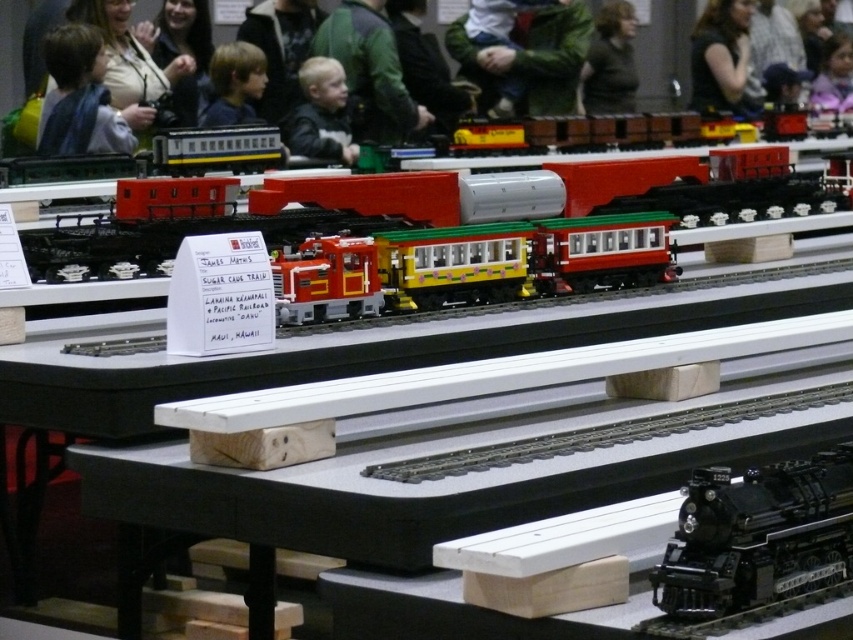
Does yellow matte train car at center have a greater width compared to blue fabric at upper left?

Indeed, yellow matte train car at center has a greater width compared to blue fabric at upper left.

Locate an element on the screen. The width and height of the screenshot is (853, 640). yellow matte train car at center is located at coordinates (521, 259).

Who is more distant from viewer, (605, 224) or (78, 147)?

The point (78, 147) is more distant.

I want to click on yellow matte train car at center, so click(x=521, y=259).

Who is lower down, blonde hair at center or dark blue shirt at upper center?

blonde hair at center

This screenshot has width=853, height=640. I want to click on blonde hair at center, so click(322, 113).

Who is more forward, (53, 45) or (338, 83)?

Point (53, 45)

How much distance is there between blue fabric at upper left and blonde hair at center?

blue fabric at upper left is 35.87 inches from blonde hair at center.

This screenshot has width=853, height=640. Identify the location of blue fabric at upper left. (80, 99).